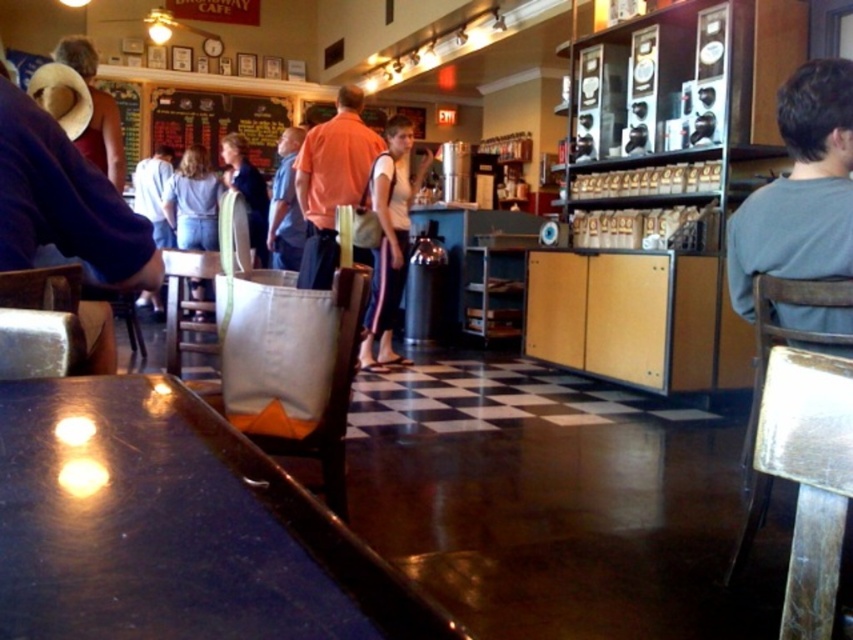
Question: Which point appears closest to the camera in this image?

Choices:
 (A) (392, 285)
 (B) (264, 234)
 (C) (199, 204)
 (D) (109, 106)

Answer: (D)

Question: Can you confirm if metallic silver table at lower right is smaller than matte brown hat at upper left?

Choices:
 (A) yes
 (B) no

Answer: (A)

Question: Is shiny dark wood table at center bigger than white fabric bag at center?

Choices:
 (A) yes
 (B) no

Answer: (B)

Question: Based on their relative distances, which object is nearer to the blue denim jeans at center?

Choices:
 (A) shiny dark wood table at center
 (B) metallic silver table at lower right
 (C) denim pants at center
 (D) white fabric bag at center

Answer: (C)

Question: In this image, where is white fabric bag at center located relative to blue denim jeans at center?

Choices:
 (A) left
 (B) right

Answer: (B)

Question: Which point is closer to the camera taking this photo?

Choices:
 (A) (373, 336)
 (B) (231, 140)

Answer: (A)